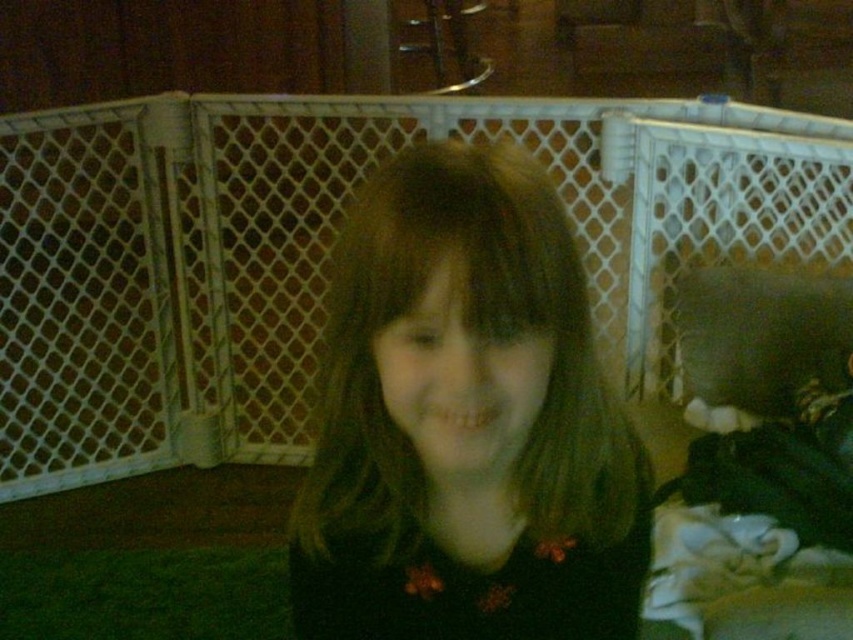
Question: Estimate the real-world distances between objects in this image. Which object is farther from the dark fabric couch at right?

Choices:
 (A) dark brown hair at center
 (B) dark gray fabric pillow at right

Answer: (A)

Question: In this image, where is dark brown hair at center located relative to dark gray fabric pillow at right?

Choices:
 (A) left
 (B) right

Answer: (A)

Question: Considering the relative positions of dark brown hair at center and dark gray fabric pillow at right in the image provided, where is dark brown hair at center located with respect to dark gray fabric pillow at right?

Choices:
 (A) left
 (B) right

Answer: (A)

Question: Considering the real-world distances, which object is farthest from the dark fabric couch at right?

Choices:
 (A) dark brown hair at center
 (B) dark gray fabric pillow at right

Answer: (A)

Question: Which point is closer to the camera taking this photo?

Choices:
 (A) (447, 472)
 (B) (757, 342)

Answer: (A)

Question: Does dark fabric couch at right lie in front of dark gray fabric pillow at right?

Choices:
 (A) no
 (B) yes

Answer: (B)